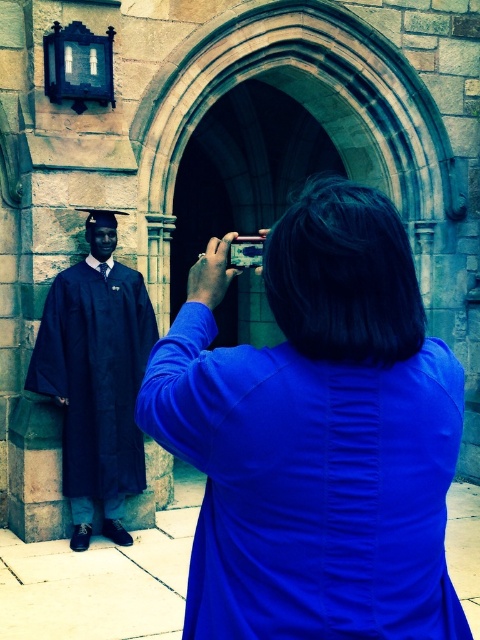
Question: Does blue fabric shirt at center come behind matte black gown at left?

Choices:
 (A) yes
 (B) no

Answer: (B)

Question: Which object appears closest to the camera in this image?

Choices:
 (A) matte black gown at left
 (B) blue fabric shirt at center

Answer: (B)

Question: Does blue fabric shirt at center appear on the left side of matte black gown at left?

Choices:
 (A) no
 (B) yes

Answer: (A)

Question: Is blue fabric shirt at center behind matte black gown at left?

Choices:
 (A) no
 (B) yes

Answer: (A)

Question: Which object is farther from the camera taking this photo?

Choices:
 (A) matte black gown at left
 (B) blue fabric shirt at center

Answer: (A)

Question: Which of the following is the farthest from the observer?

Choices:
 (A) blue fabric shirt at center
 (B) matte black gown at left

Answer: (B)